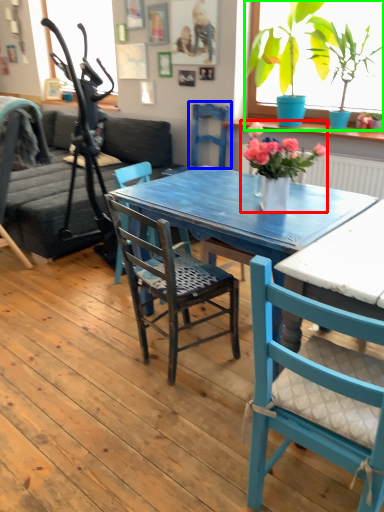
Question: Which object is positioned farthest from houseplant (highlighted by a red box)? Select from armchair (highlighted by a blue box) and houseplant (highlighted by a green box).

Choices:
 (A) armchair
 (B) houseplant

Answer: (A)